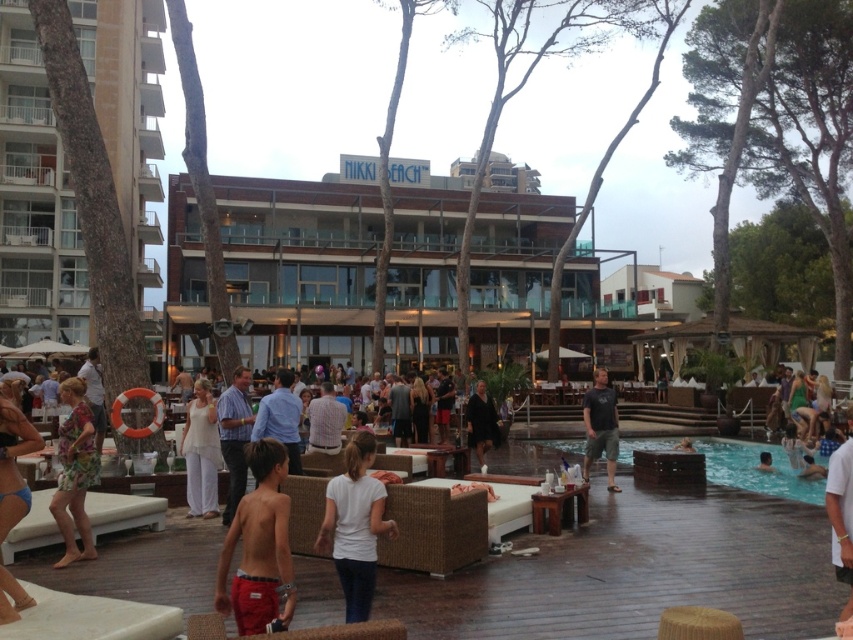
Question: Can you confirm if clear glass pool at lower right is thinner than dark gray t-shirt at center?

Choices:
 (A) yes
 (B) no

Answer: (A)

Question: Which of the following is the farthest from the observer?

Choices:
 (A) (213, 464)
 (B) (473, 396)
 (C) (355, 493)

Answer: (B)

Question: Which object appears closest to the camera in this image?

Choices:
 (A) white matte shirt at center
 (B) dark brown leather jacket at center
 (C) smooth skin person at lower right

Answer: (A)

Question: Which of these objects is positioned farthest from the floral fabric dress at lower left?

Choices:
 (A) white matte shirt at center
 (B) light blue shirt at center

Answer: (A)

Question: Is white matte shirt at center bigger than smooth skin person at lower right?

Choices:
 (A) no
 (B) yes

Answer: (B)

Question: Is clear glass pool at lower right closer to the viewer compared to dark gray t-shirt at center?

Choices:
 (A) yes
 (B) no

Answer: (B)